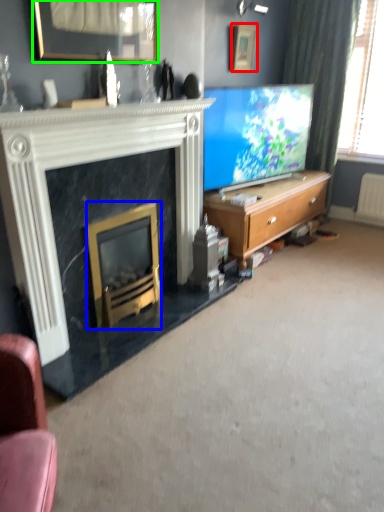
Question: Estimate the real-world distances between objects in this image. Which object is closer to picture frame (highlighted by a red box), fireplace (highlighted by a blue box) or picture frame (highlighted by a green box)?

Choices:
 (A) fireplace
 (B) picture frame

Answer: (B)